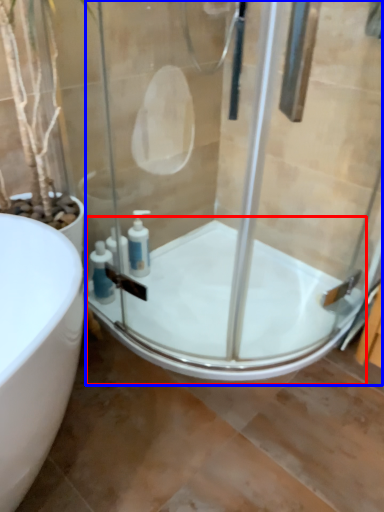
Question: Among these objects, which one is nearest to the camera, bath (highlighted by a red box) or shower door (highlighted by a blue box)?

Choices:
 (A) bath
 (B) shower door

Answer: (B)